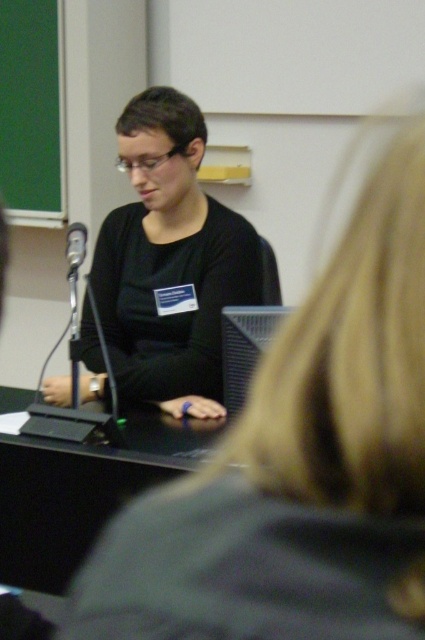
Is black matte shirt at center in front of black plastic microphone at left?

No, it is not.

Is point (248, 292) positioned after point (68, 230)?

That is False.

Who is more forward, (127, 349) or (85, 234)?

Point (85, 234) is more forward.

Locate an element on the screen. black matte shirt at center is located at coordinates (170, 260).

Who is positioned more to the left, green chalkboard at upper left or black plastic microphone at left?

green chalkboard at upper left is more to the left.

Measure the distance from green chalkboard at upper left to black plastic microphone at left.

The distance of green chalkboard at upper left from black plastic microphone at left is 5.29 feet.

Is point (13, 122) positioned after point (65, 250)?

No, it is in front of (65, 250).

Where is `green chalkboard at upper left`? green chalkboard at upper left is located at coordinates (33, 112).

I want to click on black matte shirt at center, so point(170,260).

The height and width of the screenshot is (640, 425). What do you see at coordinates (170, 260) in the screenshot?
I see `black matte shirt at center` at bounding box center [170, 260].

From the picture: Who is more distant from viewer, (159,275) or (2,4)?

Point (2,4)

Where is `black matte shirt at center`? The image size is (425, 640). black matte shirt at center is located at coordinates (170, 260).